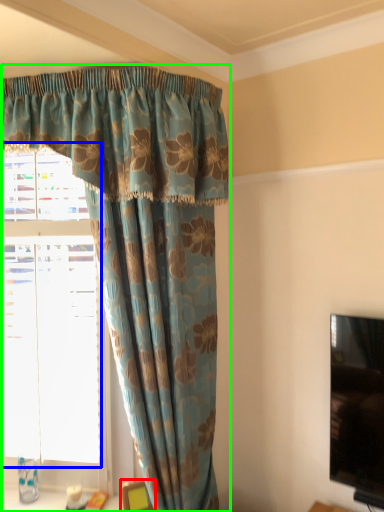
Question: Considering the real-world distances, which object is farthest from furniture (highlighted by a red box)? bay window (highlighted by a blue box) or curtain (highlighted by a green box)?

Choices:
 (A) bay window
 (B) curtain

Answer: (B)